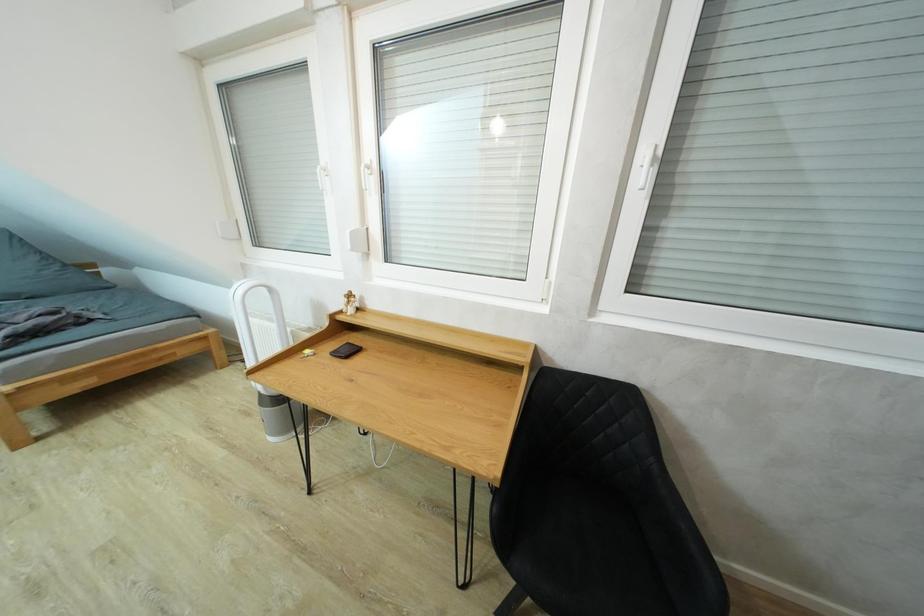
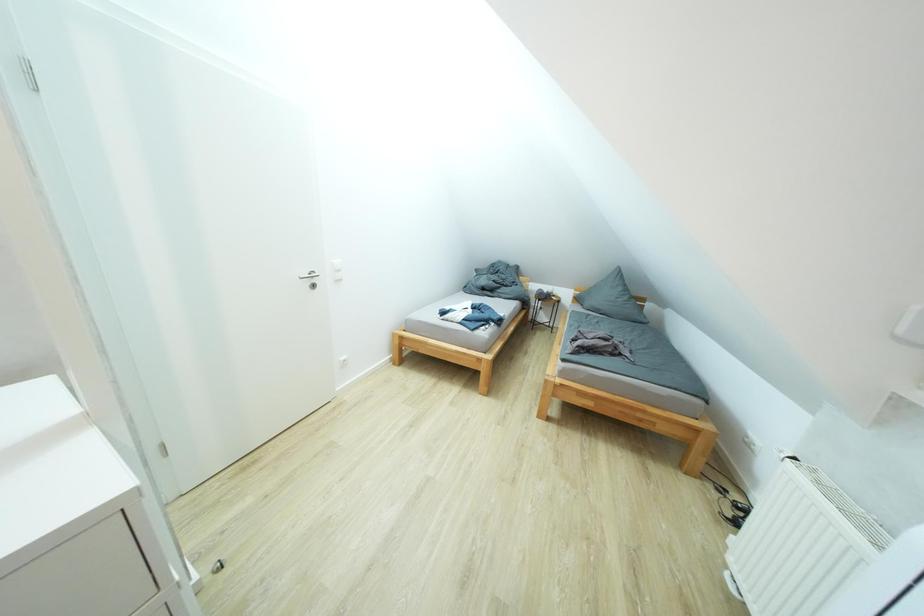
Question: The first image is from the beginning of the video and the second image is from the end. How did the camera likely rotate when shooting the video?

Choices:
 (A) Left
 (B) Right
 (C) Up
 (D) Down

Answer: (A)